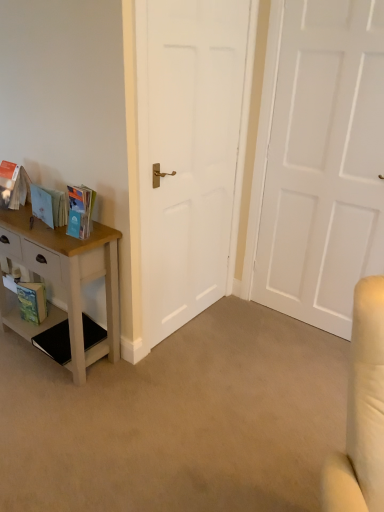
Identify the location of free space in front of matte blue book at left, placed as the third book when sorted from left to right. This screenshot has height=512, width=384. (72, 244).